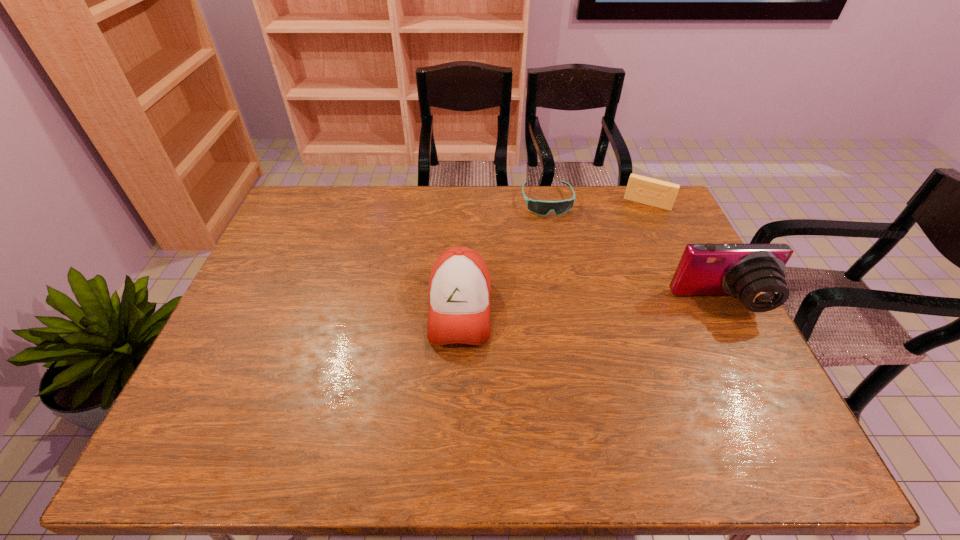
Image resolution: width=960 pixels, height=540 pixels. What are the coordinates of `the leftmost object` in the screenshot? It's located at (459, 290).

Locate an element on the screen. Image resolution: width=960 pixels, height=540 pixels. camera is located at coordinates (753, 273).

The width and height of the screenshot is (960, 540). In order to click on the second shortest object in this screenshot , I will do `click(661, 194)`.

You are a GUI agent. You are given a task and a screenshot of the screen. Output one action in this format:
    pyautogui.click(x=<x>, y=<y>)
    Task: Click on the second object from left to right
    The width and height of the screenshot is (960, 540).
    Given the screenshot: What is the action you would take?
    pyautogui.click(x=539, y=207)

At what (x,y) coordinates should I click in order to perform the action: click on the shortest object. Please return your answer as a coordinate pair (x, y). Looking at the image, I should click on (539, 207).

The height and width of the screenshot is (540, 960). I want to click on blank space located on the front-facing side of the camera, so click(764, 386).

What are the coordinates of `vacant space located 0.150m at the front of the videotape with spools` in the screenshot? It's located at (631, 235).

Image resolution: width=960 pixels, height=540 pixels. In order to click on vacant space located at the front of the videotape with spools in this screenshot , I will do `click(633, 230)`.

The width and height of the screenshot is (960, 540). In order to click on free space located at the front of the videotape with spools in this screenshot , I will do `click(618, 267)`.

In order to click on vacant area situated 0.130m on the front-facing side of the second object from left to right in this screenshot , I will do `click(557, 243)`.